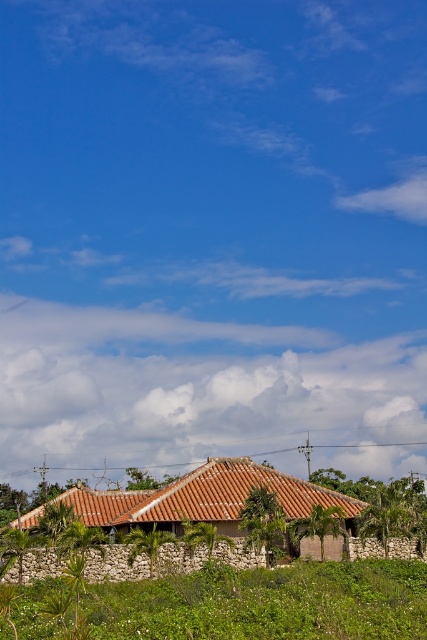
Question: Is green leafy vegetation at lower center thinner than brown clay roof at center?

Choices:
 (A) no
 (B) yes

Answer: (B)

Question: Can you confirm if green leafy vegetation at lower center is positioned above brown clay roof at center?

Choices:
 (A) no
 (B) yes

Answer: (B)

Question: Which of the following is the farthest from the observer?

Choices:
 (A) (251, 592)
 (B) (193, 470)

Answer: (B)

Question: Which point is farther to the camera?

Choices:
 (A) (198, 636)
 (B) (76, 502)

Answer: (B)

Question: Is the position of green leafy vegetation at lower center more distant than that of brown clay roof at center?

Choices:
 (A) no
 (B) yes

Answer: (A)